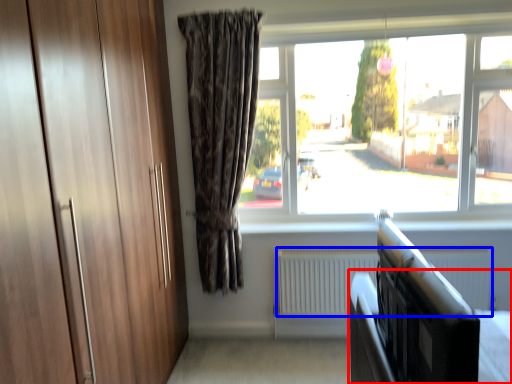
Question: Which point is further to the camera, bed frame (highlighted by a red box) or radiator (highlighted by a blue box)?

Choices:
 (A) bed frame
 (B) radiator

Answer: (B)